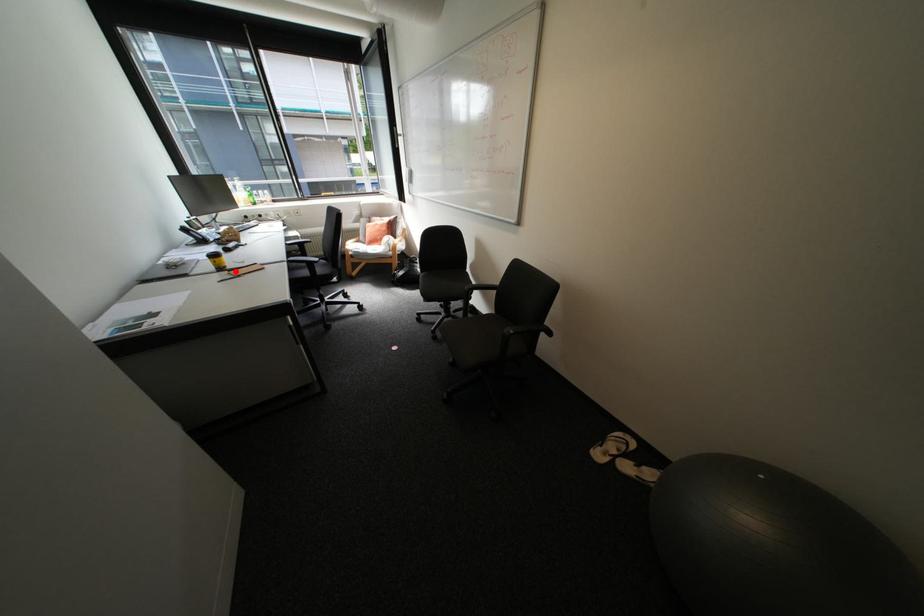
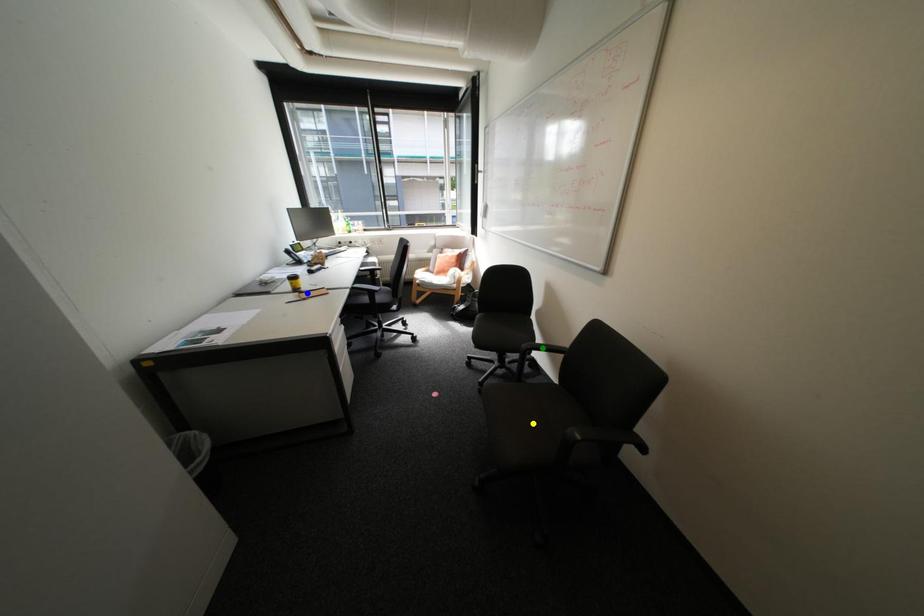
Question: I am providing you with two images of the same scene from different viewpoints. A red point is marked on the first image. You are given multiple points on the second image. Which point in image 2 is actually the same real-world point as the red point in image 1?

Choices:
 (A) yellow point
 (B) green point
 (C) blue point

Answer: (C)